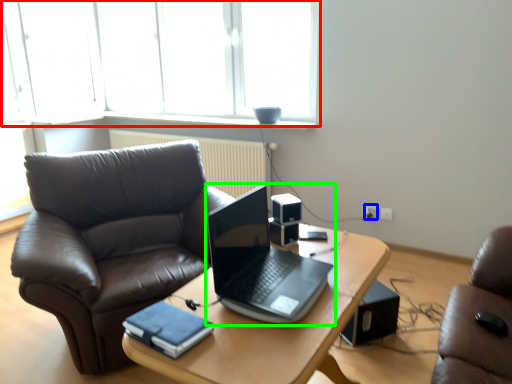
Question: Which is nearer to the window (highlighted by a red box)? power outlet (highlighted by a blue box) or laptop (highlighted by a green box).

Choices:
 (A) power outlet
 (B) laptop

Answer: (A)